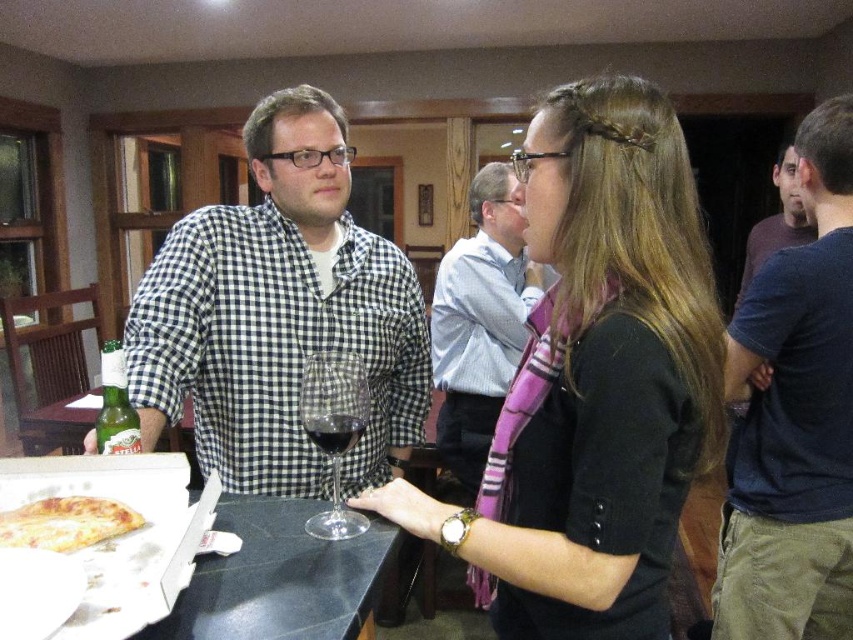
Is green glass bottle at left shorter than dark glass wine at center?

Incorrect, green glass bottle at left's height does not fall short of dark glass wine at center's.

Identify the location of green glass bottle at left. This screenshot has width=853, height=640. (115, 404).

Find the location of a particular element. The width and height of the screenshot is (853, 640). green glass bottle at left is located at coordinates (115, 404).

Find the location of `green glass bottle at left`. green glass bottle at left is located at coordinates (115, 404).

Looking at this image, measure the distance from checkered fabric shirt at left to transparent glass at center.

checkered fabric shirt at left and transparent glass at center are 27.52 centimeters apart from each other.

Is checkered fabric shirt at left below transparent glass at center?

No.

What do you see at coordinates (279, 316) in the screenshot? The width and height of the screenshot is (853, 640). I see `checkered fabric shirt at left` at bounding box center [279, 316].

The image size is (853, 640). In order to click on checkered fabric shirt at left in this screenshot , I will do `click(279, 316)`.

Which of these two, light blue shirt at center or golden crispy pizza at center, stands shorter?

golden crispy pizza at center

Which is in front, point (485, 170) or point (88, 531)?

Point (88, 531) is in front.

This screenshot has height=640, width=853. What are the coordinates of `light blue shirt at center` in the screenshot? It's located at (480, 321).